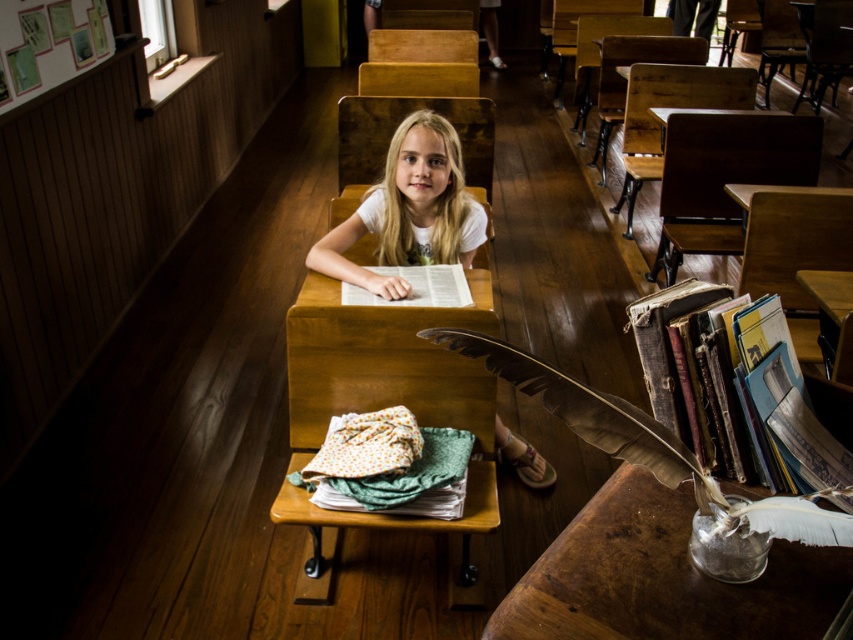
Does wooden at center lie behind wooden frame at upper left?

No, wooden at center is closer to the viewer.

Is wooden at center above wooden frame at upper left?

Incorrect, wooden at center is not positioned above wooden frame at upper left.

Describe the element at coordinates (384, 362) in the screenshot. The image size is (853, 640). I see `wooden at center` at that location.

Find the location of a particular element. This screenshot has height=640, width=853. wooden at center is located at coordinates (384, 362).

Between wooden desk at center and hardcover books at right, which one appears on the right side from the viewer's perspective?

Positioned to the right is hardcover books at right.

Based on the photo, is wooden desk at center positioned in front of hardcover books at right?

Yes, wooden desk at center is closer to the viewer.

The width and height of the screenshot is (853, 640). In order to click on wooden desk at center in this screenshot , I will do 662,577.

The width and height of the screenshot is (853, 640). What are the coordinates of `wooden desk at center` in the screenshot? It's located at (662, 577).

Is wooden at center smaller than wooden table at center?

Incorrect, wooden at center is not smaller in size than wooden table at center.

Does wooden at center come in front of wooden table at center?

That is True.

This screenshot has height=640, width=853. Describe the element at coordinates (384, 362) in the screenshot. I see `wooden at center` at that location.

The image size is (853, 640). Identify the location of wooden at center. coord(384,362).